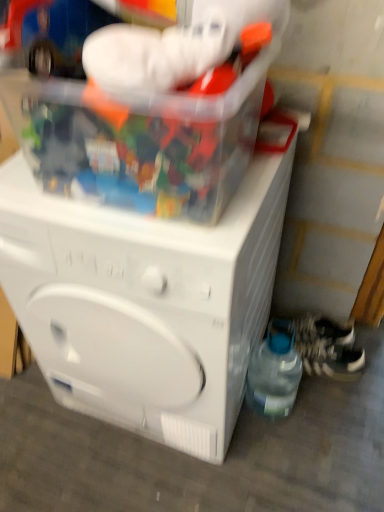
Locate an element on the screen. white textured shoe at lower right, arranged as the first shoe when ordered from the bottom is located at coordinates (328, 348).

What do you see at coordinates (323, 331) in the screenshot?
I see `white textured shoe at lower right, marked as the 2th shoe in a bottom-to-top arrangement` at bounding box center [323, 331].

Find the location of a particular element. This screenshot has height=512, width=384. transparent plastic bottle at lower right is located at coordinates (274, 371).

At what (x,y) coordinates should I click in order to perform the action: click on white plastic washing machine at center. Please return your answer as a coordinate pair (x, y). The height and width of the screenshot is (512, 384). Looking at the image, I should click on (145, 303).

Is transparent plastic bottle at lower right directly adjacent to white textured shoe at lower right, marked as the 2th shoe in a bottom-to-top arrangement?

transparent plastic bottle at lower right is not next to white textured shoe at lower right, marked as the 2th shoe in a bottom-to-top arrangement, and they're not touching.

From a real-world perspective, is transparent plastic bottle at lower right above or below white textured shoe at lower right, which ranks as the 1th shoe in top-to-bottom order?

Clearly, from a real-world perspective, transparent plastic bottle at lower right is above white textured shoe at lower right, which ranks as the 1th shoe in top-to-bottom order.

Between transparent plastic bottle at lower right and white textured shoe at lower right, marked as the 2th shoe in a bottom-to-top arrangement, which one has smaller size?

With smaller size is white textured shoe at lower right, marked as the 2th shoe in a bottom-to-top arrangement.

Could white textured shoe at lower right, which ranks as the 1th shoe in top-to-bottom order, be considered to be inside transparent plastic bottle at lower right?

That's incorrect, white textured shoe at lower right, which ranks as the 1th shoe in top-to-bottom order, is not inside transparent plastic bottle at lower right.

Image resolution: width=384 pixels, height=512 pixels. What are the coordinates of `toy that appears on the left of white textured shoe at lower right, marked as the 2th shoe in a bottom-to-top arrangement` in the screenshot? It's located at (147, 108).

Is translucent plastic container at upper center a part of white textured shoe at lower right, marked as the 2th shoe in a bottom-to-top arrangement?

That's incorrect, translucent plastic container at upper center is not inside white textured shoe at lower right, marked as the 2th shoe in a bottom-to-top arrangement.

Which point is more forward, (337, 337) or (150, 145)?

Result: Positioned in front is point (150, 145).

From the image's perspective, between white textured shoe at lower right, marked as the 2th shoe in a bottom-to-top arrangement, and translucent plastic container at upper center, which one is located above?

translucent plastic container at upper center appears higher in the image.

Is transparent plastic bottle at lower right not close to white plastic washing machine at center?

No, there isn't a large distance between transparent plastic bottle at lower right and white plastic washing machine at center.

Relative to white plastic washing machine at center, is transparent plastic bottle at lower right in front or behind?

transparent plastic bottle at lower right is behind white plastic washing machine at center.

Is transparent plastic bottle at lower right taller than white plastic washing machine at center?

No.

Is translucent plastic container at upper center facing away from white textured shoe at lower right, which ranks as the 1th shoe in top-to-bottom order?

translucent plastic container at upper center does not have its back to white textured shoe at lower right, which ranks as the 1th shoe in top-to-bottom order.

Considering the sizes of objects translucent plastic container at upper center and white textured shoe at lower right, which ranks as the 1th shoe in top-to-bottom order, in the image provided, who is bigger, translucent plastic container at upper center or white textured shoe at lower right, which ranks as the 1th shoe in top-to-bottom order,?

With larger size is translucent plastic container at upper center.

Does translucent plastic container at upper center contain white textured shoe at lower right, marked as the 2th shoe in a bottom-to-top arrangement?

That's incorrect, white textured shoe at lower right, marked as the 2th shoe in a bottom-to-top arrangement, is not inside translucent plastic container at upper center.

Considering the positions of objects translucent plastic container at upper center and white textured shoe at lower right, which ranks as the 1th shoe in top-to-bottom order, in the image provided, who is more to the right, translucent plastic container at upper center or white textured shoe at lower right, which ranks as the 1th shoe in top-to-bottom order,?

white textured shoe at lower right, which ranks as the 1th shoe in top-to-bottom order, is more to the right.

This screenshot has width=384, height=512. I want to click on toy that is in front of the white textured shoe at lower right, arranged as the first shoe when ordered from the bottom, so click(x=147, y=108).

Between translucent plastic container at upper center and white textured shoe at lower right, arranged as the first shoe when ordered from the bottom, which one has more height?

translucent plastic container at upper center is taller.

From the image's perspective, is translucent plastic container at upper center positioned above or below white textured shoe at lower right, which appears as the second shoe when viewed from the top?

Clearly, from the image's perspective, translucent plastic container at upper center is above white textured shoe at lower right, which appears as the second shoe when viewed from the top.

Is white textured shoe at lower right, arranged as the first shoe when ordered from the bottom, at the back of translucent plastic container at upper center?

No, translucent plastic container at upper center is not facing the opposite direction of white textured shoe at lower right, arranged as the first shoe when ordered from the bottom.

From a real-world perspective, relative to transparent plastic bottle at lower right, is white textured shoe at lower right, marked as the 2th shoe in a bottom-to-top arrangement, vertically above or below?

white textured shoe at lower right, marked as the 2th shoe in a bottom-to-top arrangement, is below transparent plastic bottle at lower right.

Considering the relative sizes of white textured shoe at lower right, which ranks as the 1th shoe in top-to-bottom order, and transparent plastic bottle at lower right in the image provided, is white textured shoe at lower right, which ranks as the 1th shoe in top-to-bottom order, shorter than transparent plastic bottle at lower right?

Indeed, white textured shoe at lower right, which ranks as the 1th shoe in top-to-bottom order, has a lesser height compared to transparent plastic bottle at lower right.

Which of these two, white textured shoe at lower right, marked as the 2th shoe in a bottom-to-top arrangement, or transparent plastic bottle at lower right, is wider?

white textured shoe at lower right, marked as the 2th shoe in a bottom-to-top arrangement, is wider.

Based on the photo, how many degrees apart are the facing directions of white textured shoe at lower right, which ranks as the 1th shoe in top-to-bottom order, and transparent plastic bottle at lower right?

79.8 degrees.

Is point (325, 332) closer or farther from the camera than point (167, 285)?

Point (325, 332) appears to be farther away from the viewer than point (167, 285).

Who is bigger, white textured shoe at lower right, which ranks as the 1th shoe in top-to-bottom order, or white plastic washing machine at center?

Bigger between the two is white plastic washing machine at center.

From a real-world perspective, between white textured shoe at lower right, marked as the 2th shoe in a bottom-to-top arrangement, and white plastic washing machine at center, who is vertically lower?

white textured shoe at lower right, marked as the 2th shoe in a bottom-to-top arrangement, is physically lower.

Is white textured shoe at lower right, marked as the 2th shoe in a bottom-to-top arrangement, oriented away from white plastic washing machine at center?

No, white plastic washing machine at center is not at the back of white textured shoe at lower right, marked as the 2th shoe in a bottom-to-top arrangement.

Find the location of `bottle in front of the white textured shoe at lower right, which ranks as the 1th shoe in top-to-bottom order`. bottle in front of the white textured shoe at lower right, which ranks as the 1th shoe in top-to-bottom order is located at coordinates (274, 371).

From a real-world perspective, count 1st shoes downward from the translucent plastic container at upper center and point to it. Please provide its 2D coordinates.

[(323, 331)]

Considering their positions, is white textured shoe at lower right, which ranks as the 1th shoe in top-to-bottom order, positioned closer to transparent plastic bottle at lower right than translucent plastic container at upper center?

white textured shoe at lower right, which ranks as the 1th shoe in top-to-bottom order.

Considering their positions, is white textured shoe at lower right, which ranks as the 1th shoe in top-to-bottom order, positioned further to white plastic washing machine at center than translucent plastic container at upper center?

white textured shoe at lower right, which ranks as the 1th shoe in top-to-bottom order, lies further to white plastic washing machine at center than the other object.

When comparing their distances from white textured shoe at lower right, which appears as the second shoe when viewed from the top, does white textured shoe at lower right, which ranks as the 1th shoe in top-to-bottom order, or transparent plastic bottle at lower right seem closer?

white textured shoe at lower right, which ranks as the 1th shoe in top-to-bottom order, is closer to white textured shoe at lower right, which appears as the second shoe when viewed from the top.

From the image, which object appears to be nearer to translucent plastic container at upper center, white textured shoe at lower right, which appears as the second shoe when viewed from the top, or transparent plastic bottle at lower right?

transparent plastic bottle at lower right lies closer to translucent plastic container at upper center than the other object.

Looking at the image, which one is located further to white plastic washing machine at center, white textured shoe at lower right, which appears as the second shoe when viewed from the top, or transparent plastic bottle at lower right?

white textured shoe at lower right, which appears as the second shoe when viewed from the top, is further to white plastic washing machine at center.

Which object lies further to the anchor point white plastic washing machine at center, white textured shoe at lower right, marked as the 2th shoe in a bottom-to-top arrangement, or transparent plastic bottle at lower right?

white textured shoe at lower right, marked as the 2th shoe in a bottom-to-top arrangement, is positioned further to the anchor white plastic washing machine at center.

When comparing their distances from white textured shoe at lower right, marked as the 2th shoe in a bottom-to-top arrangement, does white textured shoe at lower right, arranged as the first shoe when ordered from the bottom, or white plastic washing machine at center seem further?

The object further to white textured shoe at lower right, marked as the 2th shoe in a bottom-to-top arrangement, is white plastic washing machine at center.

Estimate the real-world distances between objects in this image. Which object is closer to white plastic washing machine at center, transparent plastic bottle at lower right or white textured shoe at lower right, marked as the 2th shoe in a bottom-to-top arrangement?

Among the two, transparent plastic bottle at lower right is located nearer to white plastic washing machine at center.

Where is `washing machine positioned between translucent plastic container at upper center and white textured shoe at lower right, which appears as the second shoe when viewed from the top, from near to far`? The width and height of the screenshot is (384, 512). washing machine positioned between translucent plastic container at upper center and white textured shoe at lower right, which appears as the second shoe when viewed from the top, from near to far is located at coordinates (145, 303).

Identify the location of shoe positioned between transparent plastic bottle at lower right and white textured shoe at lower right, marked as the 2th shoe in a bottom-to-top arrangement, from near to far. point(328,348).

You are a GUI agent. You are given a task and a screenshot of the screen. Output one action in this format:
    pyautogui.click(x=<x>, y=<y>)
    Task: Click on the washing machine positioned between translucent plastic container at upper center and white textured shoe at lower right, marked as the 2th shoe in a bottom-to-top arrangement, from near to far
    This screenshot has height=512, width=384.
    Given the screenshot: What is the action you would take?
    pyautogui.click(x=145, y=303)

You are a GUI agent. You are given a task and a screenshot of the screen. Output one action in this format:
    pyautogui.click(x=<x>, y=<y>)
    Task: Click on the bottle between translucent plastic container at upper center and white textured shoe at lower right, which appears as the second shoe when viewed from the top, in the front-back direction
    The width and height of the screenshot is (384, 512).
    Given the screenshot: What is the action you would take?
    pyautogui.click(x=274, y=371)